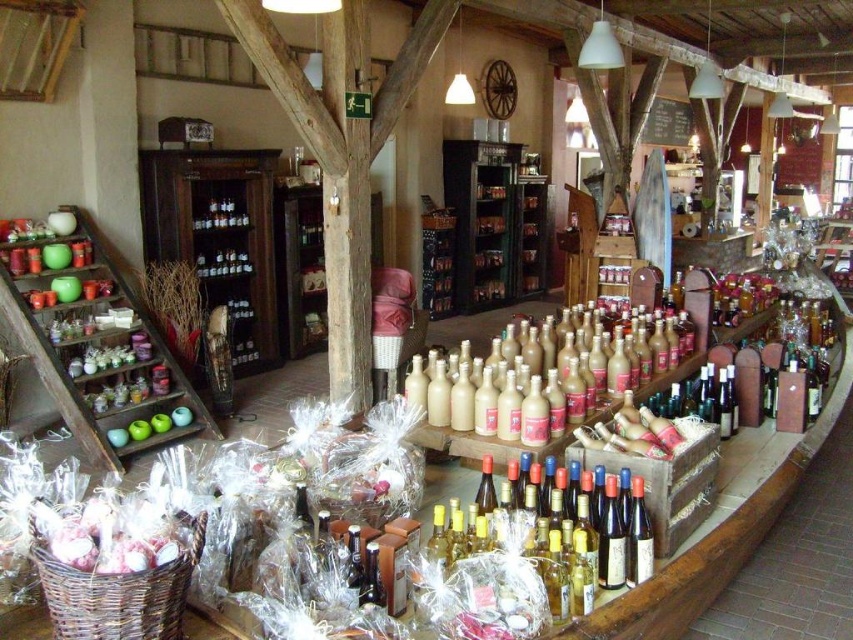
You are standing at the entrance of the shop and see the point marked at coordinates (97, 349). Based on the scene description, where is this point located?

The point marked at coordinates (97, 349) is located on the wooden shelves at the left side of the shop.

You are standing at the entrance of the rustic shop. There is a point marked at coordinates (105, 387) in the scene. Can you estimate how far this point is from your current position?

The point at (105, 387) is 15.45 feet away from the viewer.

You are standing at the entrance of the shop and want to reach the wooden shelves at left. Which direction should you move to get there?

Since the wooden shelves at left are located at the left side of the shop, you should move to your left to reach them.